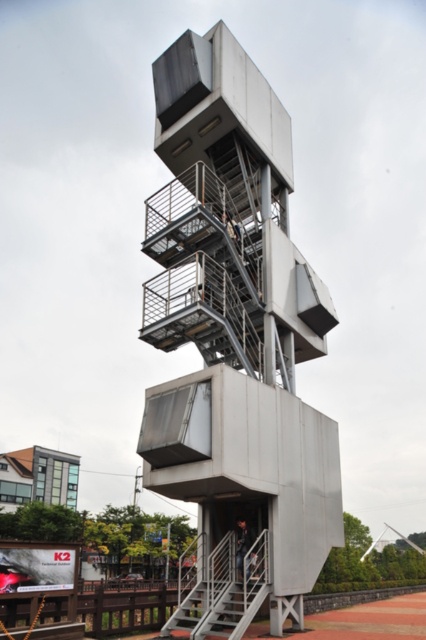
Does metallic silver observation tower at center come in front of metallic gray stairs at center?

No.

Which of these two, metallic silver observation tower at center or metallic gray stairs at center, stands taller?

Standing taller between the two is metallic silver observation tower at center.

Where is `metallic silver observation tower at center`? This screenshot has width=426, height=640. metallic silver observation tower at center is located at coordinates (236, 333).